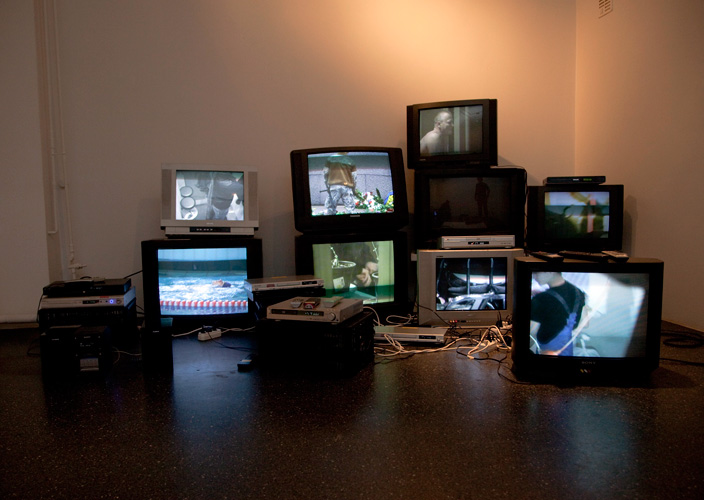
I want to click on remote, so click(619, 256).